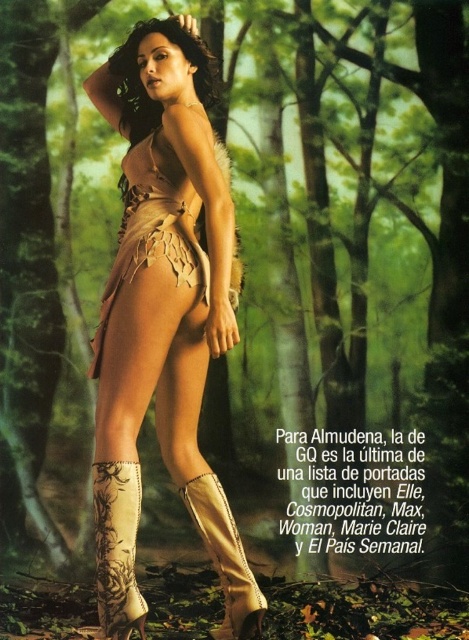
You are a photographer trying to capture the woman in the forest scene. You notice a point at coordinates (118, 547) in your viewfinder. Based on the scene description, can you identify what this point corresponds to on the woman?

The point at coordinates (118, 547) corresponds to the beige leather cowboy boot at lower center.